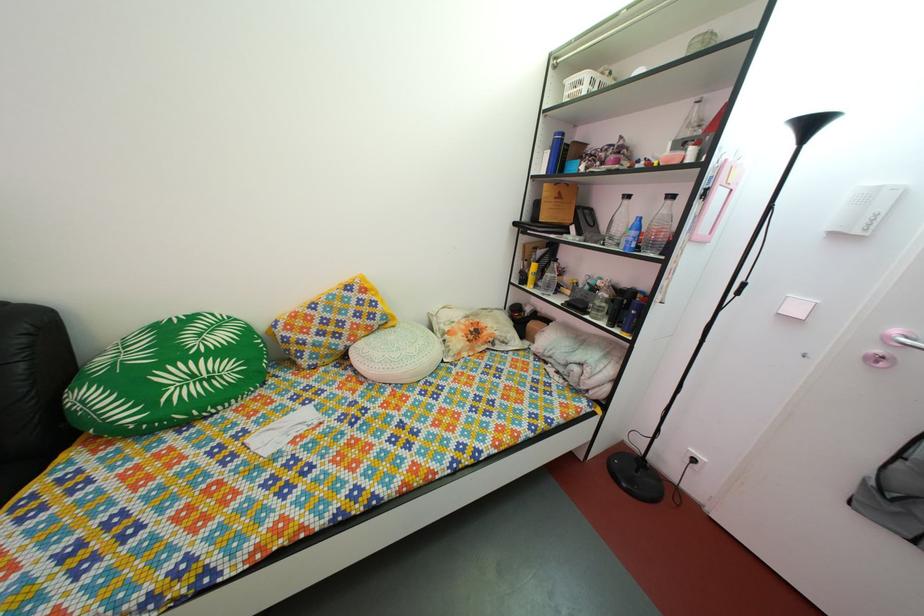
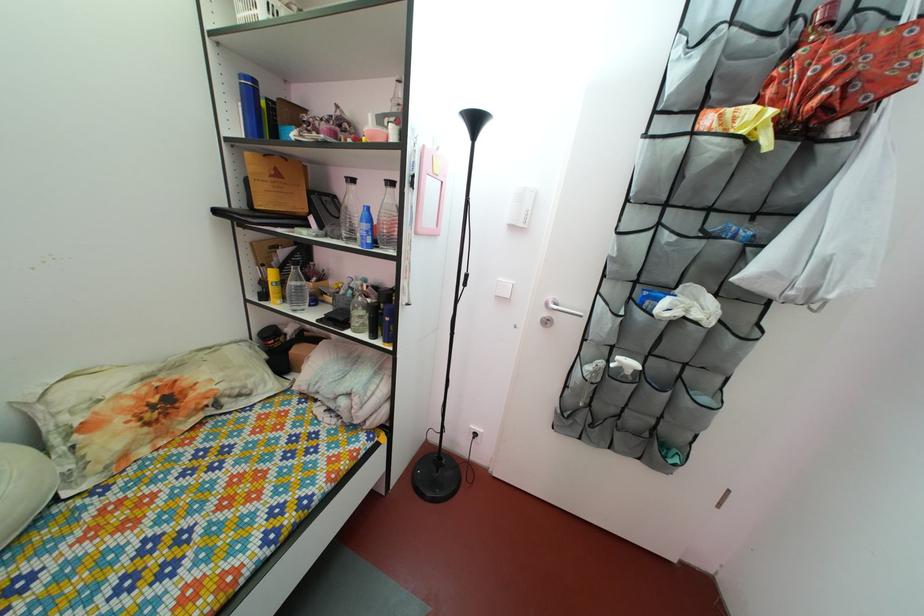
Find the pixel in the second image that matches pixel 626 253 in the first image.

(363, 248)